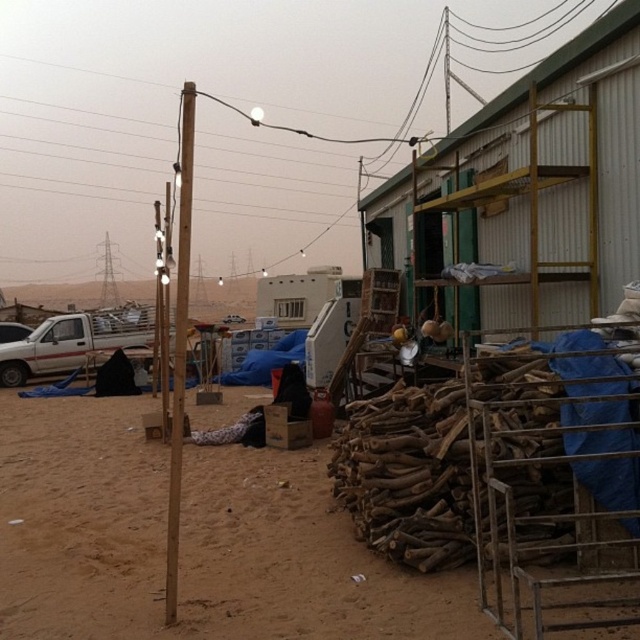
Question: Does white matte truck at left have a lesser width compared to brown wooden pole at center?

Choices:
 (A) yes
 (B) no

Answer: (A)

Question: Which object appears farthest from the camera in this image?

Choices:
 (A) white matte truck at left
 (B) brown wooden pole at center
 (C) brown sandy dirt at lower left

Answer: (A)

Question: Which object appears farthest from the camera in this image?

Choices:
 (A) white matte truck at left
 (B) brown sandy dirt at lower left
 (C) brown wooden pole at center

Answer: (A)

Question: Which of these objects is positioned farthest from the brown wooden pole at center?

Choices:
 (A) brown sandy dirt at lower left
 (B) white matte truck at left

Answer: (B)

Question: Is white matte truck at left thinner than brown wooden pole at center?

Choices:
 (A) no
 (B) yes

Answer: (B)

Question: Does brown sandy dirt at lower left appear under white matte truck at left?

Choices:
 (A) no
 (B) yes

Answer: (B)